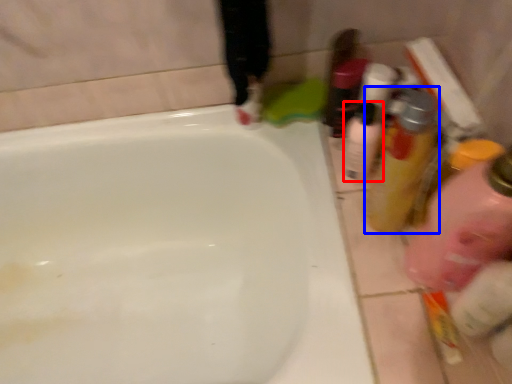
Question: Among these objects, which one is nearest to the camera, mouthwash (highlighted by a red box) or mouthwash (highlighted by a blue box)?

Choices:
 (A) mouthwash
 (B) mouthwash

Answer: (B)